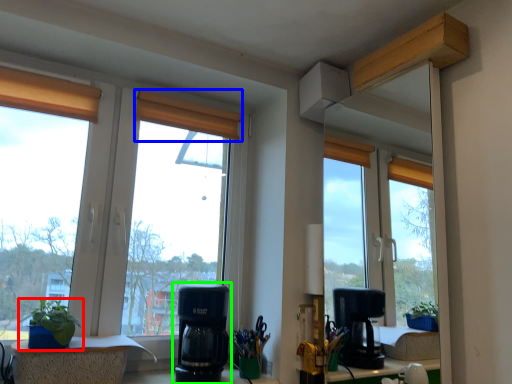
Question: Considering the real-world distances, which object is closest to houseplant (highlighted by a red box)? curtain (highlighted by a blue box) or coffee maker (highlighted by a green box).

Choices:
 (A) curtain
 (B) coffee maker

Answer: (B)